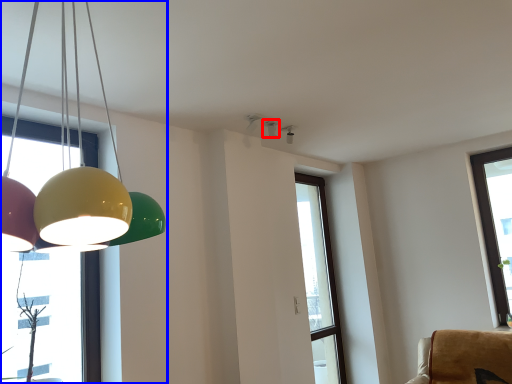
Question: Which object is closer to the camera taking this photo, lamp (highlighted by a red box) or lamp (highlighted by a blue box)?

Choices:
 (A) lamp
 (B) lamp

Answer: (B)